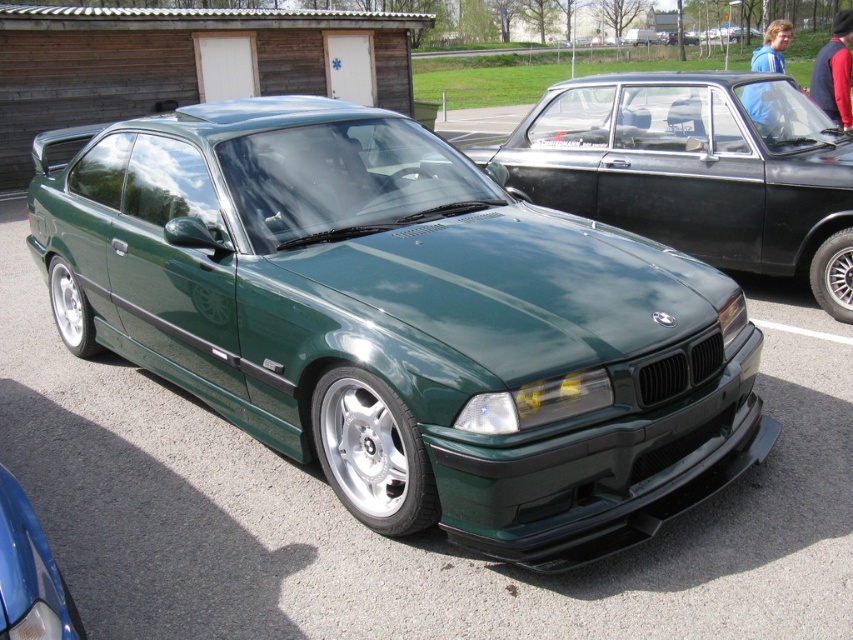
Which is in front, point (230, 211) or point (714, 250)?

Point (230, 211)

Locate an element on the screen. green metallic car at center is located at coordinates (403, 321).

What do you see at coordinates (697, 170) in the screenshot? I see `green matte car at center` at bounding box center [697, 170].

Is green matte car at center to the right of metallic blue car at lower left from the viewer's perspective?

Correct, you'll find green matte car at center to the right of metallic blue car at lower left.

Is point (675, 93) farther from camera compared to point (0, 480)?

Yes, it is behind point (0, 480).

Locate an element on the screen. The image size is (853, 640). green matte car at center is located at coordinates [x=697, y=170].

Does green metallic car at center have a lesser width compared to metallic blue car at lower left?

Incorrect, green metallic car at center's width is not less than metallic blue car at lower left's.

Between point (340, 220) and point (51, 605), which one is positioned in front?

Point (51, 605) is more forward.

The height and width of the screenshot is (640, 853). What are the coordinates of `green metallic car at center` in the screenshot? It's located at (403, 321).